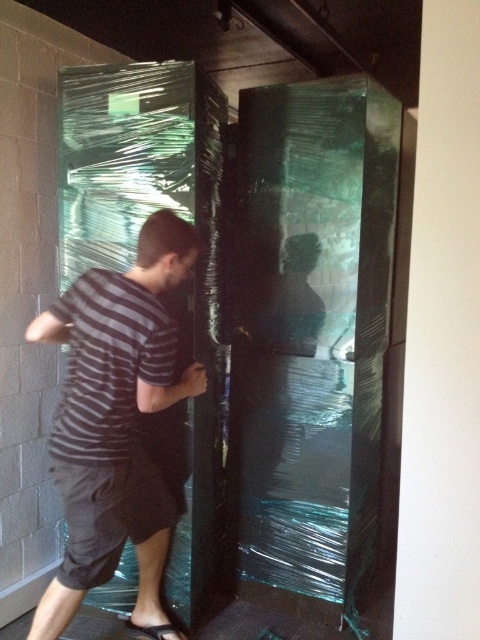
Is striped cotton shirt at left positioned in front of striped cotton shirt at center?

That is False.

Who is higher up, striped cotton shirt at left or striped cotton shirt at center?

striped cotton shirt at center is above.

Which is in front, point (126, 276) or point (142, 355)?

Point (142, 355)

Identify the location of striped cotton shirt at left. Image resolution: width=480 pixels, height=640 pixels. (116, 420).

Is striped cotton shirt at left taller than dark gray cotton shorts at lower left?

Indeed, striped cotton shirt at left has a greater height compared to dark gray cotton shorts at lower left.

You are a GUI agent. You are given a task and a screenshot of the screen. Output one action in this format:
    pyautogui.click(x=<x>, y=<y>)
    Task: Click on the striped cotton shirt at left
    
    Given the screenshot: What is the action you would take?
    pyautogui.click(x=116, y=420)

I want to click on striped cotton shirt at left, so click(x=116, y=420).

You are a GUI agent. You are given a task and a screenshot of the screen. Output one action in this format:
    pyautogui.click(x=<x>, y=<y>)
    Task: Click on the transparent plastic door at center
    
    Given the screenshot: What is the action you would take?
    pyautogui.click(x=309, y=340)

Who is more distant from viewer, (320, 397) or (183, 636)?

The point (320, 397) is behind.

Identify the location of transparent plastic door at center. The width and height of the screenshot is (480, 640). tap(309, 340).

You are a GUI agent. You are given a task and a screenshot of the screen. Output one action in this format:
    pyautogui.click(x=<x>, y=<y>)
    Task: Click on the transparent plastic door at center
    The height and width of the screenshot is (640, 480).
    Given the screenshot: What is the action you would take?
    pyautogui.click(x=309, y=340)